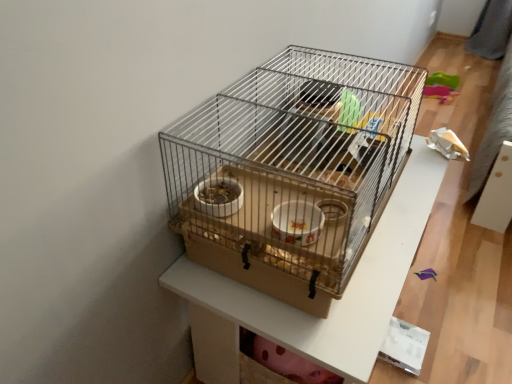
I want to click on spots to the right of metal wire cage at center, so click(x=457, y=292).